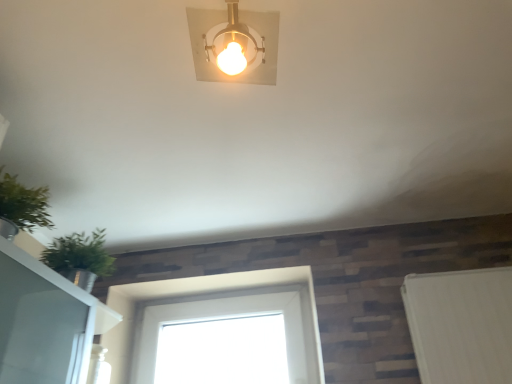
Question: From a real-world perspective, relative to green leafy plant at left, is gold metallic light fixture at upper center vertically above or below?

Choices:
 (A) above
 (B) below

Answer: (A)

Question: Considering the positions of gold metallic light fixture at upper center and green leafy plant at left in the image, is gold metallic light fixture at upper center wider or thinner than green leafy plant at left?

Choices:
 (A) thin
 (B) wide

Answer: (A)

Question: Estimate the real-world distances between objects in this image. Which object is farther from the gold metallic light fixture at upper center?

Choices:
 (A) white glass window at center
 (B) green leafy plant at left

Answer: (A)

Question: Based on their relative distances, which object is farther from the white glass window at center?

Choices:
 (A) gold metallic light fixture at upper center
 (B) green leafy plant at left

Answer: (A)